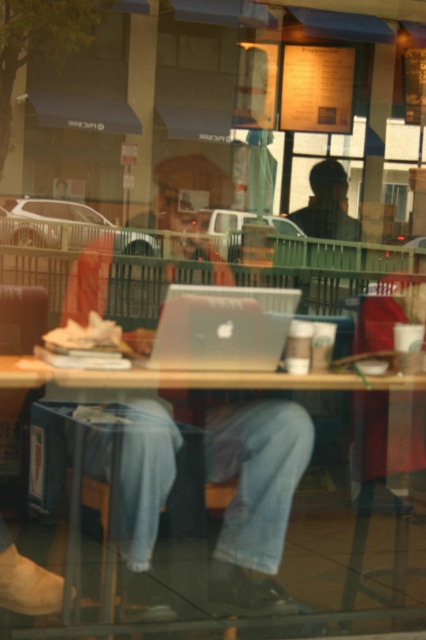
Which is more to the left, wooden table at center or satin silver laptop at center?

Positioned to the left is satin silver laptop at center.

Between wooden table at center and satin silver laptop at center, which one appears on the right side from the viewer's perspective?

Positioned to the right is wooden table at center.

Who is more forward, (77, 540) or (244, 358)?

Point (77, 540)

I want to click on wooden table at center, so click(x=192, y=508).